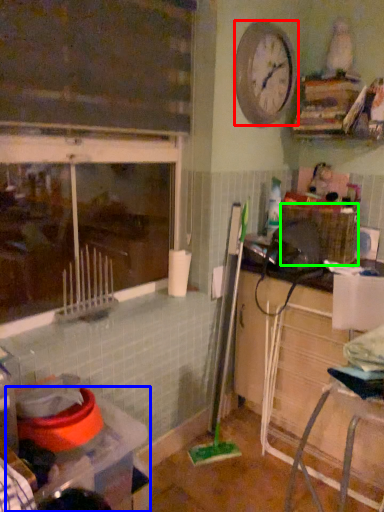
Question: Based on their relative distances, which object is nearer to clock (highlighted by a red box)? Choose from table (highlighted by a blue box) and crate (highlighted by a green box).

Choices:
 (A) table
 (B) crate

Answer: (B)